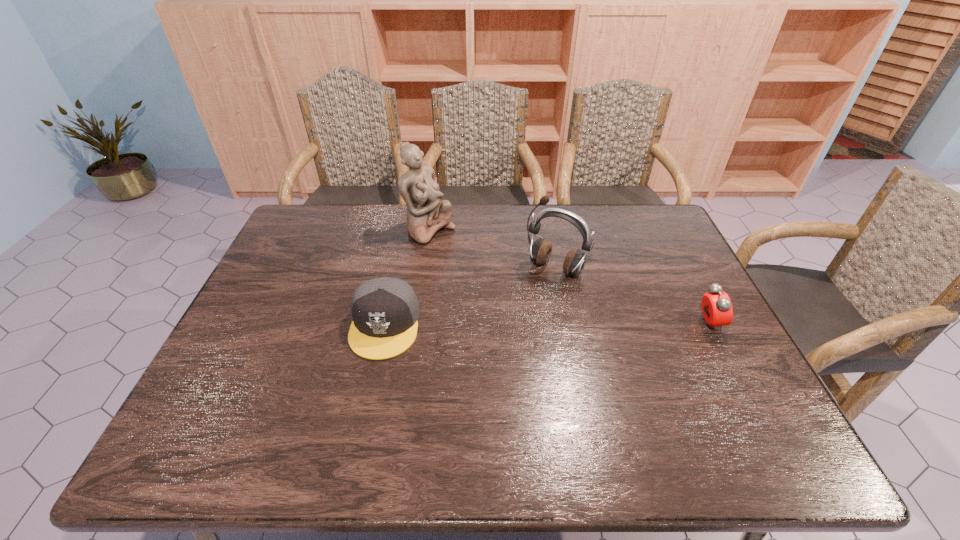
You are a GUI agent. You are given a task and a screenshot of the screen. Output one action in this format:
    pyautogui.click(x=<x>, y=<y>)
    Task: Click on the vacant space that is in between the third shortest object and the cap
    The height and width of the screenshot is (540, 960).
    Given the screenshot: What is the action you would take?
    pyautogui.click(x=470, y=296)

Find the location of a particular element. The image size is (960, 540). free space between the farthest object and the rightmost object is located at coordinates (569, 278).

You are a GUI agent. You are given a task and a screenshot of the screen. Output one action in this format:
    pyautogui.click(x=<x>, y=<y>)
    Task: Click on the free area in between the tallest object and the third nearest object
    
    Given the screenshot: What is the action you would take?
    pyautogui.click(x=492, y=249)

At what (x,y) coordinates should I click in order to perform the action: click on vacant space that is in between the cap and the third nearest object. Please return your answer as a coordinate pair (x, y). Looking at the image, I should click on (470, 296).

Identify the location of blank region between the cap and the earphone. (470, 296).

Locate an element on the screen. vacant space that is in between the farthest object and the alarm clock is located at coordinates (569, 278).

Where is `free space between the alarm clock and the earphone`? free space between the alarm clock and the earphone is located at coordinates (632, 296).

Identify the location of unoccupied position between the cap and the farthest object. This screenshot has width=960, height=540. (407, 278).

What are the coordinates of `free space between the cap and the rightmost object` in the screenshot? It's located at (547, 325).

This screenshot has height=540, width=960. In order to click on free space between the tallest object and the third nearest object in this screenshot , I will do `click(492, 249)`.